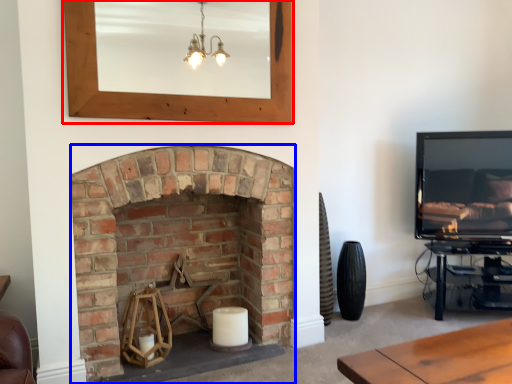
Question: Which object is closer to the camera taking this photo, picture frame (highlighted by a red box) or fireplace (highlighted by a blue box)?

Choices:
 (A) picture frame
 (B) fireplace

Answer: (A)